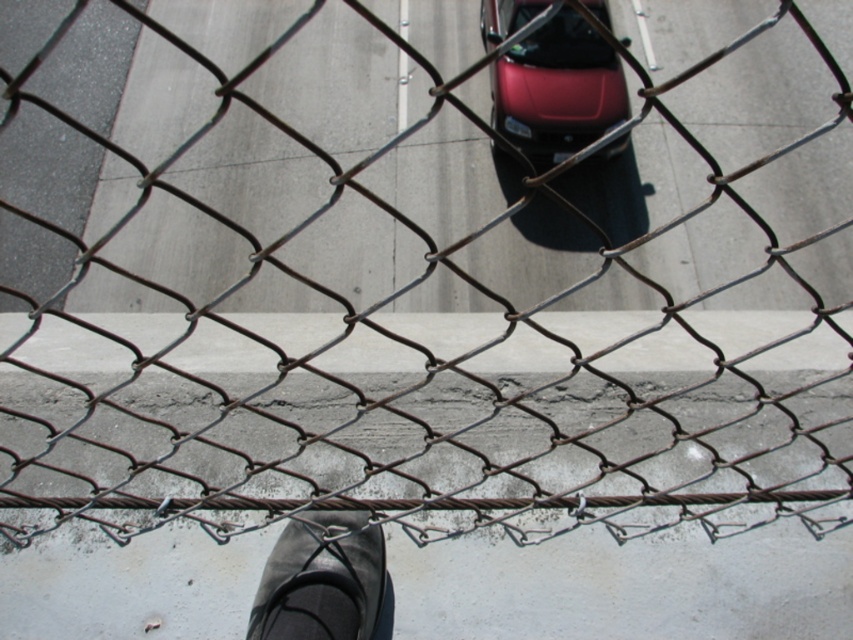
Consider the image. Can you confirm if glossy red car at center is taller than black rubber shoe at lower center?

Indeed, glossy red car at center has a greater height compared to black rubber shoe at lower center.

Is point (556, 125) more distant than point (323, 520)?

Yes, point (556, 125) is farther from viewer.

Is point (616, 152) more distant than point (351, 552)?

Yes, it is.

The height and width of the screenshot is (640, 853). Find the location of `glossy red car at center`. glossy red car at center is located at coordinates (556, 88).